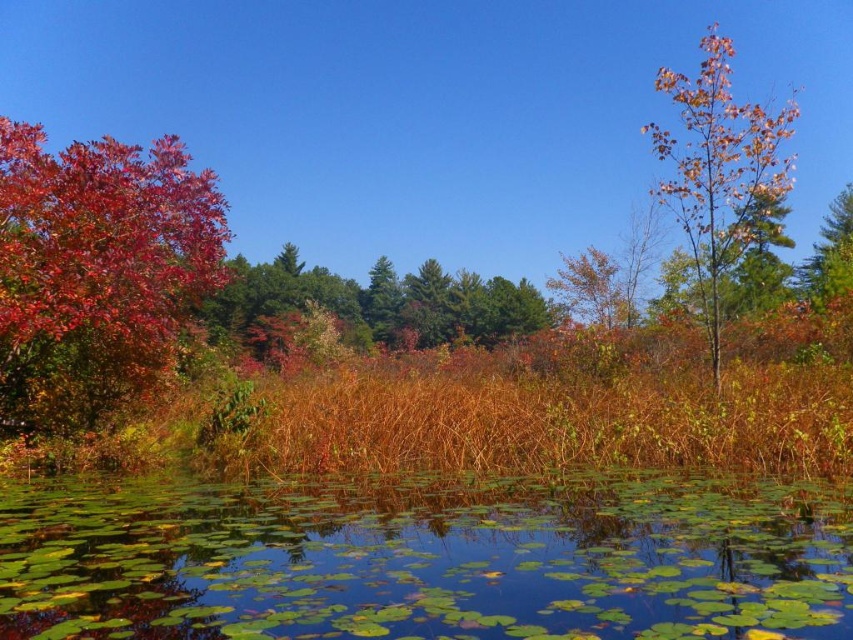
You are an artist planning to paint the autumn scene. You have to decide which area to focus on first between the green leafy water at bottom and the shiny red leaves at left. Which object should you paint first if you want to paint the smaller one first?

The green leafy water at bottom is smaller than the shiny red leaves at left, so you should paint the green leafy water at bottom first.

Looking at this image, what is the location of the green leafy water at bottom in the image?

The green leafy water at bottom is located at point (425, 561).